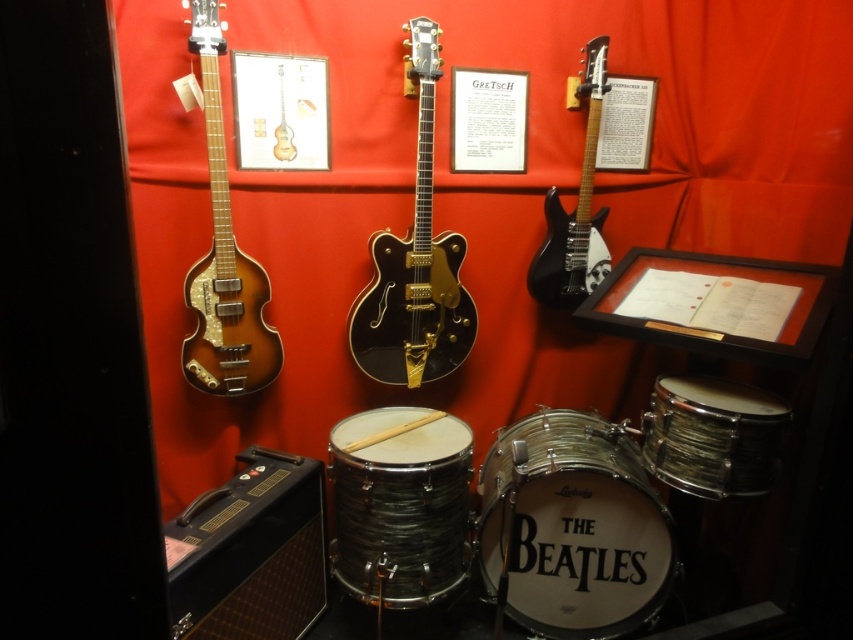
Question: Estimate the real-world distances between objects in this image. Which object is farther from the glossy black guitar at center?

Choices:
 (A) wooden snare drum at lower right
 (B) black textured drum at center
 (C) white leather drum at lower right

Answer: (A)

Question: Which point appears closest to the camera in this image?

Choices:
 (A) (334, 540)
 (B) (543, 502)
 (C) (561, 276)
 (D) (444, 314)

Answer: (B)

Question: Which of the following is the farthest from the observer?

Choices:
 (A) satin wood bass guitar at left
 (B) glossy black guitar at center

Answer: (B)

Question: Does glossy black guitar at center appear on the left side of satin wood bass guitar at left?

Choices:
 (A) no
 (B) yes

Answer: (A)

Question: Considering the relative positions of black textured drum at center and wooden snare drum at lower right in the image provided, where is black textured drum at center located with respect to wooden snare drum at lower right?

Choices:
 (A) left
 (B) right

Answer: (A)

Question: Can you confirm if white leather drum at lower right is positioned to the right of glossy black guitar at center?

Choices:
 (A) yes
 (B) no

Answer: (A)